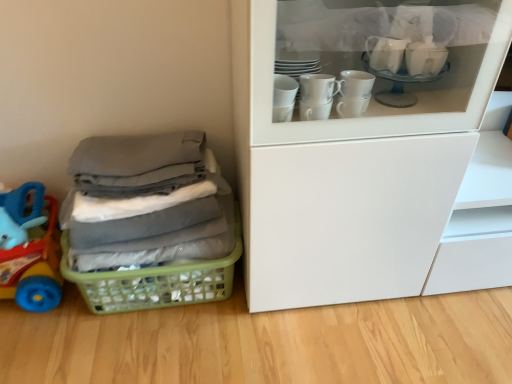
Question: Choose the correct answer: Is green plastic basket at lower left inside rubberized blue toy at left or outside it?

Choices:
 (A) inside
 (B) outside

Answer: (B)

Question: Looking at their shapes, would you say green plastic basket at lower left is wider or thinner than rubberized blue toy at left?

Choices:
 (A) thin
 (B) wide

Answer: (B)

Question: Estimate the real-world distances between objects in this image. Which object is closer to the green plastic basket at lower left?

Choices:
 (A) rubberized blue toy at left
 (B) gray fabric at left

Answer: (B)

Question: Estimate the real-world distances between objects in this image. Which object is closer to the rubberized blue toy at left?

Choices:
 (A) gray fabric at left
 (B) green plastic basket at lower left

Answer: (B)